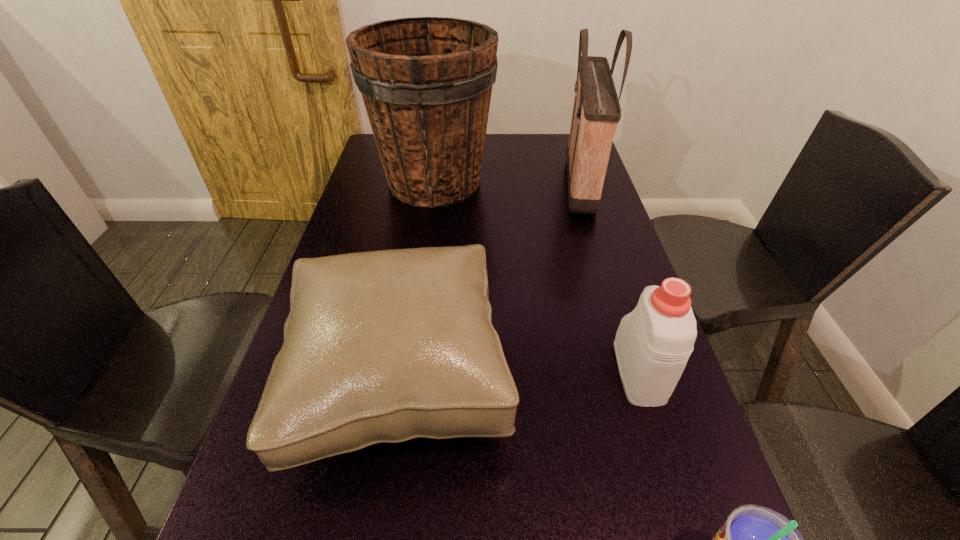
Where is `free space between the detergent and the cushion`? free space between the detergent and the cushion is located at coordinates (520, 375).

At what (x,y) coordinates should I click in order to perform the action: click on free space between the bucket and the detergent. Please return your answer as a coordinate pair (x, y). Image resolution: width=960 pixels, height=540 pixels. Looking at the image, I should click on (537, 277).

Where is `unoccupied position between the detergent and the cushion`? unoccupied position between the detergent and the cushion is located at coordinates (520, 375).

The width and height of the screenshot is (960, 540). I want to click on free space between the cushion and the shopping bag, so pos(491,281).

Image resolution: width=960 pixels, height=540 pixels. In order to click on free spot between the detergent and the shopping bag in this screenshot , I will do `click(610, 278)`.

I want to click on empty space between the detergent and the bucket, so click(537, 277).

At what (x,y) coordinates should I click in order to perform the action: click on object identified as the fourth closest to the nearest object. Please return your answer as a coordinate pair (x, y). This screenshot has height=540, width=960. Looking at the image, I should click on (426, 82).

Select which object appears as the second closest to the shopping bag. Please provide its 2D coordinates. Your answer should be formatted as a tuple, i.e. [(x, y)], where the tuple contains the x and y coordinates of a point satisfying the conditions above.

[(381, 346)]